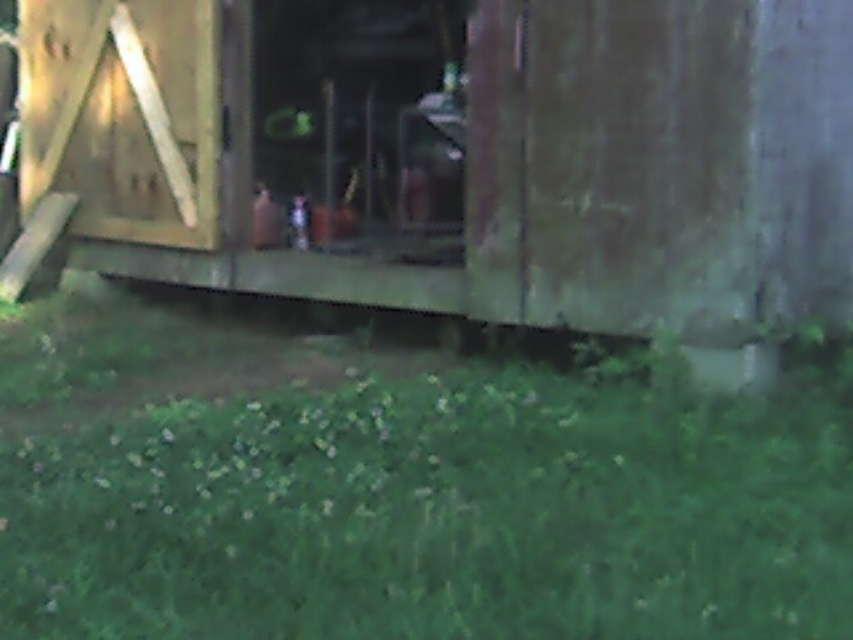
You are standing on the green grass at lower center and want to reach the wooden hut at center. Can you walk directly to it without stepping on any other objects?

The green grass at lower center is smaller than the wooden hut at center, so there is no obstruction between them. You can walk directly to the wooden hut at center without stepping on any other objects.

You are standing at a point in the grassy area and want to walk towards the wooden structure. There are two points marked on the ground, point A at coordinates point A is point [62,518] and point B at point B is point [722,19]. Which point should you walk towards to get closer to the wooden structure?

Point A at coordinates point A is point [62,518] is in front of point B at point B is point [722,19], so walking towards point A will bring you closer to the wooden structure.

You are a gardener who needs to mow the lawn. You see the green grass at lower center and the wooden hut at center. Which area should you avoid mowing because it is taller?

The wooden hut at center is taller than the green grass at lower center, so you should avoid mowing the wooden hut at center.